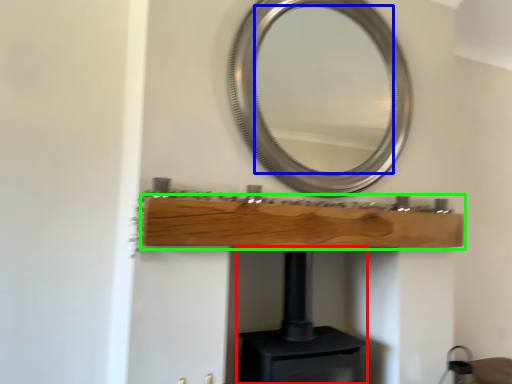
Question: Estimate the real-world distances between objects in this image. Which object is closer to fireplace (highlighted by a red box), mirror (highlighted by a blue box) or shelf (highlighted by a green box)?

Choices:
 (A) mirror
 (B) shelf

Answer: (B)